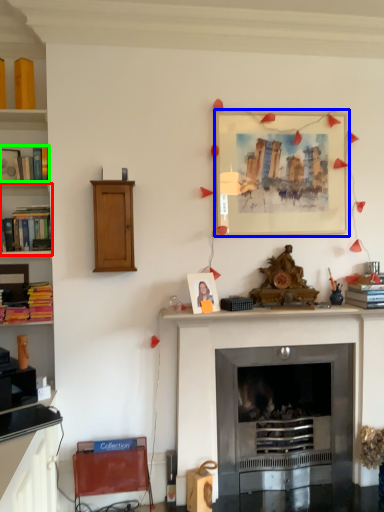
Question: Estimate the real-world distances between objects in this image. Which object is farther from shelf (highlighted by a red box), picture frame (highlighted by a blue box) or book (highlighted by a green box)?

Choices:
 (A) picture frame
 (B) book

Answer: (A)